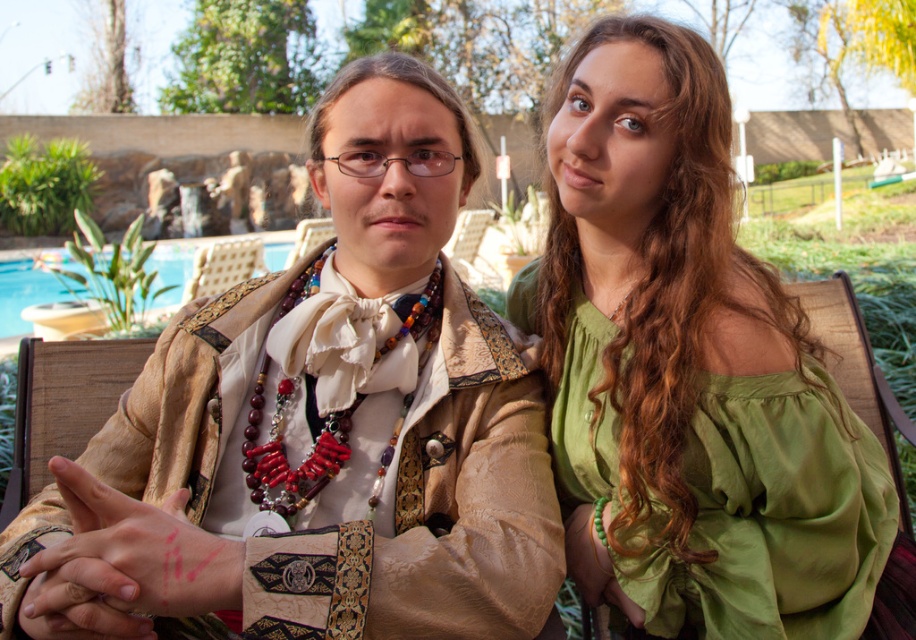
Question: Is green silk blouse at upper right in front of green beaded bracelet at lower right?

Choices:
 (A) no
 (B) yes

Answer: (B)

Question: Which object appears farthest from the camera in this image?

Choices:
 (A) matte gold jacket at center
 (B) matte brown leather hand at center
 (C) blue glass pool at left

Answer: (C)

Question: Does blue glass pool at left appear on the left side of green beaded bracelet at lower right?

Choices:
 (A) no
 (B) yes

Answer: (B)

Question: Does matte gold jacket at center have a lesser width compared to matte brown leather hand at center?

Choices:
 (A) no
 (B) yes

Answer: (A)

Question: Which of the following is the farthest from the observer?

Choices:
 (A) matte gold jacket at center
 (B) green silk blouse at upper right
 (C) matte brown leather hand at center
 (D) green beaded bracelet at lower right

Answer: (D)

Question: Among these objects, which one is nearest to the camera?

Choices:
 (A) matte gold jacket at center
 (B) green beaded bracelet at lower right
 (C) green silk blouse at upper right
 (D) blue glass pool at left

Answer: (A)